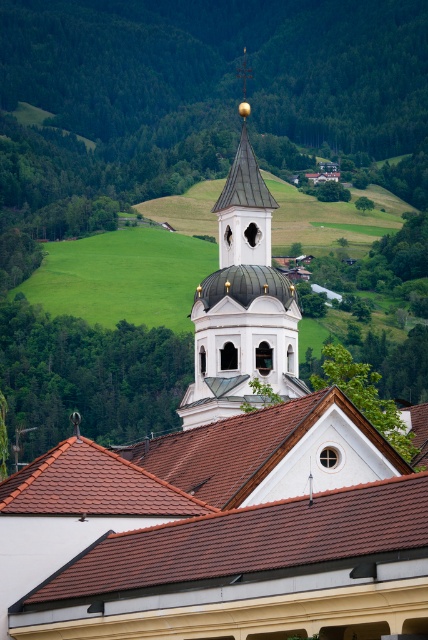
Which is below, brown tile roof at center or white glossy bell tower at center?

Positioned lower is brown tile roof at center.

Is brown tile roof at center positioned in front of white glossy bell tower at center?

Yes, it is in front of white glossy bell tower at center.

This screenshot has height=640, width=428. What are the coordinates of `brown tile roof at center` in the screenshot? It's located at (246, 540).